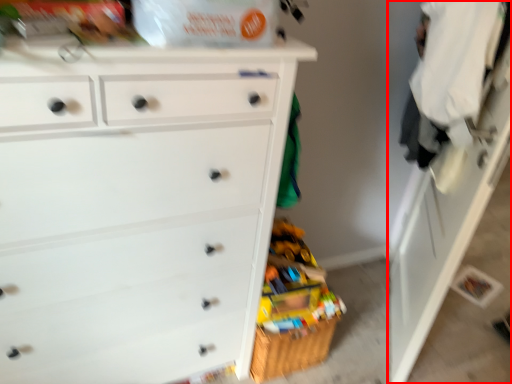
Question: Where is dresser (annotated by the red box) located in relation to chest of drawers in the image?

Choices:
 (A) left
 (B) right

Answer: (B)